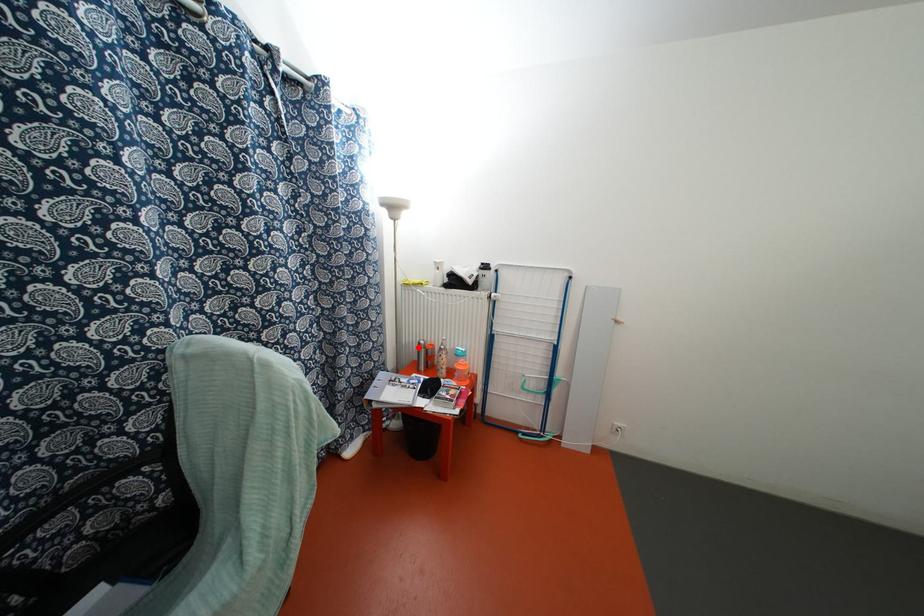
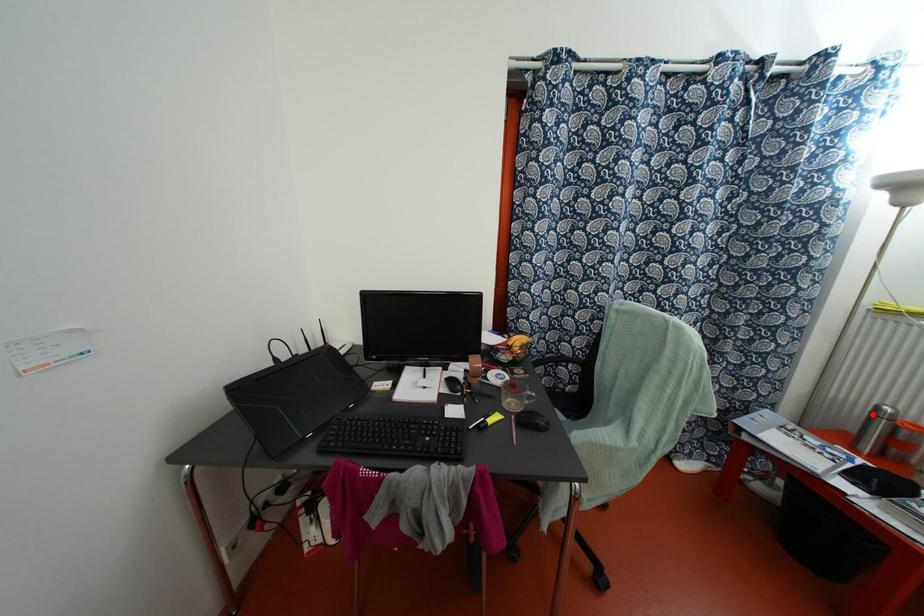
I am providing you with two images of the same scene from different viewpoints. A red point is marked on the first image and another point is marked on the second image. Are the points marked in image1 and image2 representing the same 3D position?

Yes